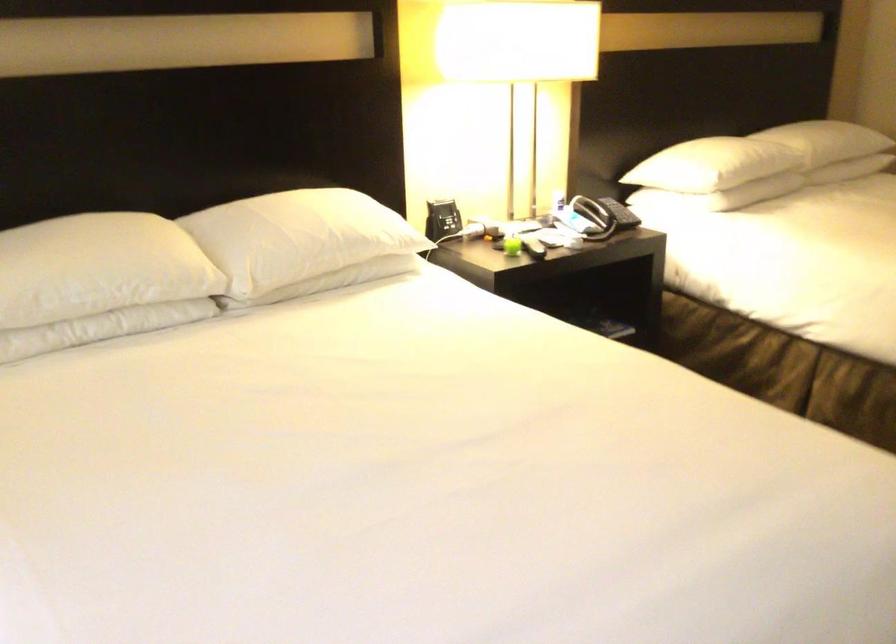
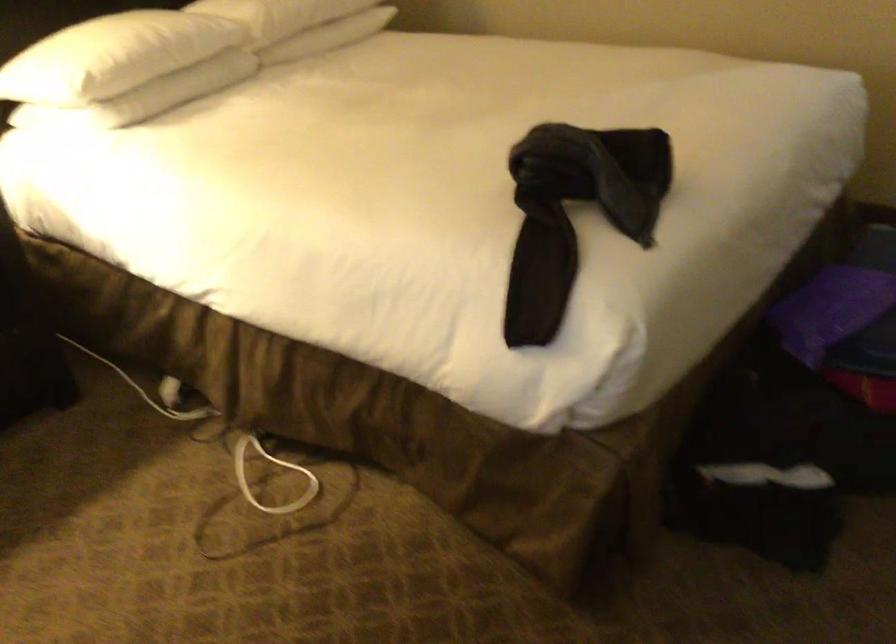
Locate, in the second image, the point that corresponds to point 731,161 in the first image.

(112, 57)